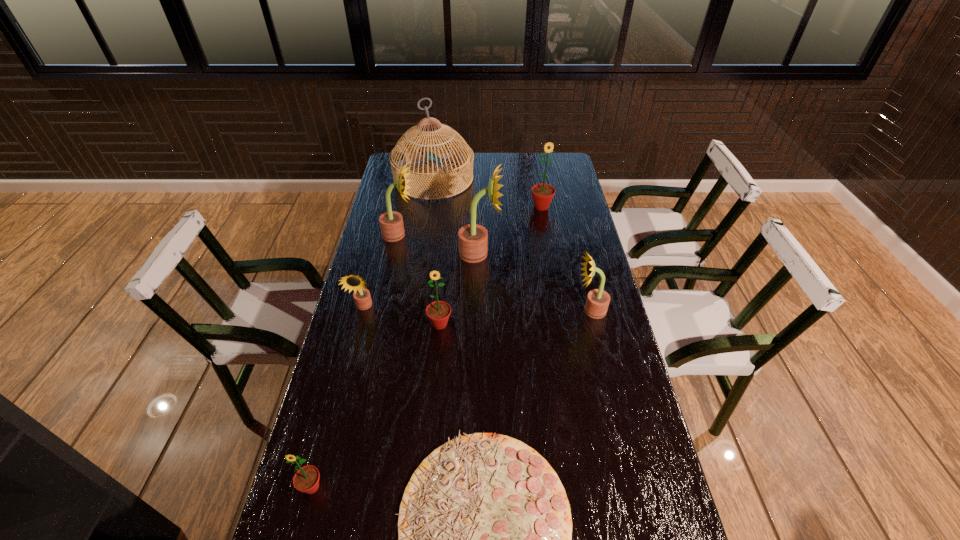
Find the location of a particular element. the smallest yellow sunflower is located at coordinates (362, 297).

Locate an element on the screen. the smallest green sunflower is located at coordinates (306, 479).

At what (x,y) coordinates should I click in order to perform the action: click on the nearest green sunflower. Please return your answer as a coordinate pair (x, y). Looking at the image, I should click on (306, 479).

The image size is (960, 540). Find the location of `free space located 0.340m on the right of the birdcage`. free space located 0.340m on the right of the birdcage is located at coordinates click(549, 178).

At what (x,y) coordinates should I click in order to perform the action: click on free spot located on the face of the fifth sunflower from left to right. Please return your answer as a coordinate pair (x, y). Looking at the image, I should click on (530, 253).

Where is `vacant region located on the face of the second biggest yellow sunflower`? vacant region located on the face of the second biggest yellow sunflower is located at coordinates (428, 235).

Find the location of `vacant space located on the face of the biggest green sunflower`. vacant space located on the face of the biggest green sunflower is located at coordinates 544,222.

Locate an element on the screen. The image size is (960, 540). free space located 0.330m on the face of the rightmost object is located at coordinates (473, 310).

In order to click on free space located on the face of the rightmost object in this screenshot , I will do pos(532,310).

Find the location of a particular element. This screenshot has width=960, height=540. free point located 0.310m on the face of the rightmost object is located at coordinates (479, 310).